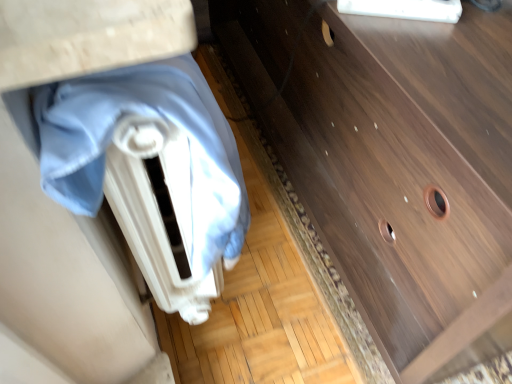
Question: Is dark wood chest of drawers at center further to the viewer compared to blue fabric at left?

Choices:
 (A) yes
 (B) no

Answer: (A)

Question: From the image's perspective, does dark wood chest of drawers at center appear lower than blue fabric at left?

Choices:
 (A) yes
 (B) no

Answer: (B)

Question: Does dark wood chest of drawers at center have a larger size compared to blue fabric at left?

Choices:
 (A) no
 (B) yes

Answer: (B)

Question: Is dark wood chest of drawers at center not near blue fabric at left?

Choices:
 (A) yes
 (B) no

Answer: (B)

Question: Is dark wood chest of drawers at center taller than blue fabric at left?

Choices:
 (A) yes
 (B) no

Answer: (A)

Question: From a real-world perspective, is dark wood chest of drawers at center positioned above or below blue fabric at left?

Choices:
 (A) above
 (B) below

Answer: (B)

Question: Is dark wood chest of drawers at center taller or shorter than blue fabric at left?

Choices:
 (A) tall
 (B) short

Answer: (A)

Question: From the image's perspective, relative to blue fabric at left, is dark wood chest of drawers at center above or below?

Choices:
 (A) above
 (B) below

Answer: (A)

Question: Would you say dark wood chest of drawers at center is inside or outside blue fabric at left?

Choices:
 (A) inside
 (B) outside

Answer: (B)

Question: From the image's perspective, relative to dark wood chest of drawers at center, is blue fabric at left above or below?

Choices:
 (A) below
 (B) above

Answer: (A)

Question: From a real-world perspective, relative to dark wood chest of drawers at center, is blue fabric at left vertically above or below?

Choices:
 (A) below
 (B) above

Answer: (B)

Question: Considering their positions, is blue fabric at left located in front of or behind dark wood chest of drawers at center?

Choices:
 (A) behind
 (B) front

Answer: (B)

Question: Does point (203, 256) appear closer or farther from the camera than point (384, 71)?

Choices:
 (A) farther
 (B) closer

Answer: (B)

Question: Considering the positions of dark wood chest of drawers at center and wooden vanity at center in the image, is dark wood chest of drawers at center wider or thinner than wooden vanity at center?

Choices:
 (A) thin
 (B) wide

Answer: (B)

Question: In the image, is dark wood chest of drawers at center on the left side or the right side of wooden vanity at center?

Choices:
 (A) left
 (B) right

Answer: (B)